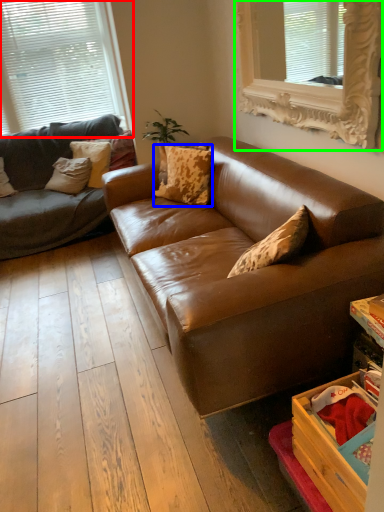
Question: Which is farther away from window (highlighted by a red box)? pillow (highlighted by a blue box) or window (highlighted by a green box)?

Choices:
 (A) pillow
 (B) window

Answer: (B)